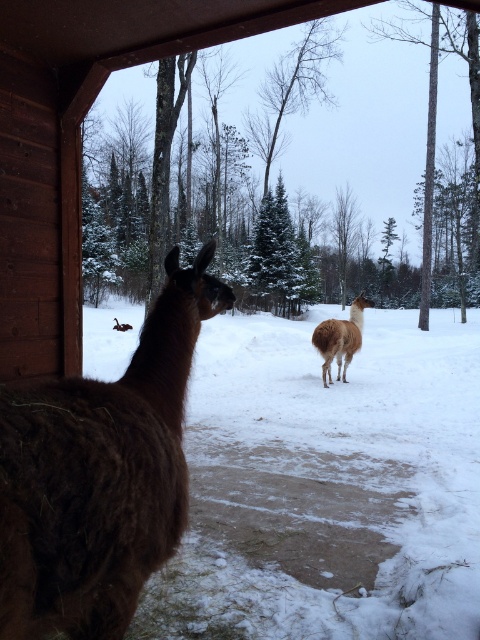
Who is more distant from viewer, (71, 570) or (328, 374)?

The point (328, 374) is more distant.

Can you confirm if brown fuzzy alpaca at left is positioned above brown woolly alpaca at center?

Indeed, brown fuzzy alpaca at left is positioned over brown woolly alpaca at center.

Is point (175, 308) farther from viewer compared to point (356, 326)?

No, (175, 308) is closer to viewer.

Find the location of a particular element. brown fuzzy alpaca at left is located at coordinates (99, 474).